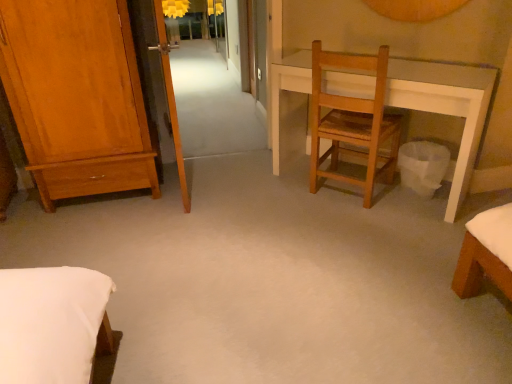
Find the location of a particular element. The height and width of the screenshot is (384, 512). vacant space to the right of transparent glass screen door at upper left is located at coordinates pos(242,188).